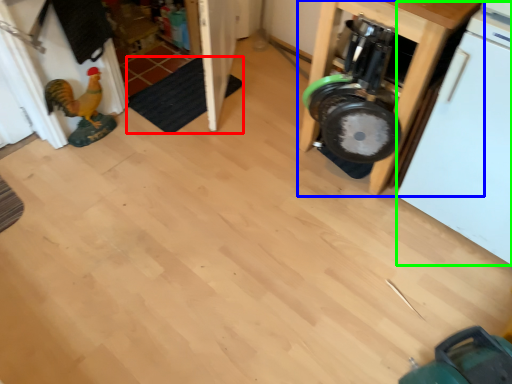
Question: Which object is the closest to the mat (highlighted by a red box)? Choose among these: furniture (highlighted by a blue box) or dish washer (highlighted by a green box).

Choices:
 (A) furniture
 (B) dish washer

Answer: (A)